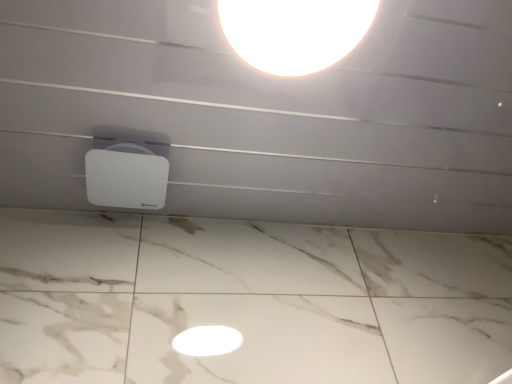
Looking at this image, in order to face white matte speaker at center, arranged as the 2th lamp when viewed from the front, should I rotate leftwards or rightwards?

Turn left by 16.755 degrees to look at white matte speaker at center, arranged as the 2th lamp when viewed from the front.

This screenshot has height=384, width=512. What do you see at coordinates (126, 179) in the screenshot?
I see `white matte speaker at center, the second lamp from the right` at bounding box center [126, 179].

The image size is (512, 384). I want to click on white matte speaker at center, arranged as the 2th lamp when viewed from the front, so tap(126, 179).

From the picture: Measure the distance between white matte speaker at center, arranged as the 2th lamp when viewed from the front, and camera.

The depth of white matte speaker at center, arranged as the 2th lamp when viewed from the front, is 36.67 inches.

Image resolution: width=512 pixels, height=384 pixels. I want to click on white glossy lampshade at upper center, placed as the 2th lamp when sorted from left to right, so click(x=294, y=32).

This screenshot has width=512, height=384. What do you see at coordinates (294, 32) in the screenshot?
I see `white glossy lampshade at upper center, the 2th lamp viewed from the back` at bounding box center [294, 32].

How much space does white glossy lampshade at upper center, positioned as the first lamp in front-to-back order, occupy vertically?

2.55 inches.

Where is `white matte speaker at center, the 1th lamp ordered from the bottom`? Image resolution: width=512 pixels, height=384 pixels. white matte speaker at center, the 1th lamp ordered from the bottom is located at coordinates (126, 179).

Is white matte speaker at center, which is the second lamp in top-to-bottom order, at the right side of white glossy lampshade at upper center, the 2th lamp viewed from the back?

No.

In the scene shown: Which is in front, white matte speaker at center, marked as the 1th lamp in a back-to-front arrangement, or white glossy lampshade at upper center, placed as the 2th lamp when sorted from left to right?

white glossy lampshade at upper center, placed as the 2th lamp when sorted from left to right, is closer to the camera.

Which is farther from the camera, (143,179) or (238,23)?

Positioned behind is point (143,179).

From the image's perspective, who appears lower, white matte speaker at center, the 1th lamp ordered from the bottom, or white glossy lampshade at upper center, the 2th lamp viewed from the back?

white matte speaker at center, the 1th lamp ordered from the bottom, appears lower in the image.

From a real-world perspective, which object stands above the other?

white matte speaker at center, which appears as the 1th lamp when viewed from the left, from a real-world perspective.

Is white matte speaker at center, marked as the 1th lamp in a back-to-front arrangement, thinner than white glossy lampshade at upper center, the second lamp from the bottom?

Yes.

Considering the relative sizes of white matte speaker at center, the 1th lamp ordered from the bottom, and white glossy lampshade at upper center, the second lamp from the bottom, in the image provided, is white matte speaker at center, the 1th lamp ordered from the bottom, taller than white glossy lampshade at upper center, the second lamp from the bottom,?

No.

In terms of size, does white matte speaker at center, marked as the 1th lamp in a back-to-front arrangement, appear bigger or smaller than white glossy lampshade at upper center, the second lamp from the bottom?

Clearly, white matte speaker at center, marked as the 1th lamp in a back-to-front arrangement, is smaller in size than white glossy lampshade at upper center, the second lamp from the bottom.

Is white glossy lampshade at upper center, placed as the 2th lamp when sorted from left to right, completely or partially inside white matte speaker at center, which appears as the 1th lamp when viewed from the left?

Definitely not — white glossy lampshade at upper center, placed as the 2th lamp when sorted from left to right, is not inside white matte speaker at center, which appears as the 1th lamp when viewed from the left.

Is white matte speaker at center, the 1th lamp ordered from the bottom, with white glossy lampshade at upper center, the second lamp from the bottom?

white matte speaker at center, the 1th lamp ordered from the bottom, is not next to white glossy lampshade at upper center, the second lamp from the bottom, and they're not touching.

Is white matte speaker at center, marked as the 1th lamp in a back-to-front arrangement, oriented towards white glossy lampshade at upper center, the 2th lamp viewed from the back?

Yes, white matte speaker at center, marked as the 1th lamp in a back-to-front arrangement, is facing white glossy lampshade at upper center, the 2th lamp viewed from the back.

How many degrees apart are the facing directions of white matte speaker at center, the second lamp from the right, and white glossy lampshade at upper center, positioned as the first lamp in front-to-back order?

The facing directions of white matte speaker at center, the second lamp from the right, and white glossy lampshade at upper center, positioned as the first lamp in front-to-back order, are 5.22 degrees apart.

The image size is (512, 384). Find the location of `lamp on the right of white matte speaker at center, arranged as the 2th lamp when viewed from the front`. lamp on the right of white matte speaker at center, arranged as the 2th lamp when viewed from the front is located at coordinates (294, 32).

In the image, is white glossy lampshade at upper center, the second lamp from the bottom, on the left side or the right side of white matte speaker at center, arranged as the 2th lamp when viewed from the front?

white glossy lampshade at upper center, the second lamp from the bottom, is positioned on white matte speaker at center, arranged as the 2th lamp when viewed from the front,'s right side.

Does white glossy lampshade at upper center, placed as the 2th lamp when sorted from left to right, come behind white matte speaker at center, which is the second lamp in top-to-bottom order?

No, it is not.

Between point (247, 48) and point (149, 165), which one is positioned in front?

Point (247, 48)

From the image's perspective, is white glossy lampshade at upper center, the 2th lamp viewed from the back, located above or below white matte speaker at center, the second lamp from the right?

From the image's perspective, white glossy lampshade at upper center, the 2th lamp viewed from the back, appears above white matte speaker at center, the second lamp from the right.

From a real-world perspective, who is located lower, white glossy lampshade at upper center, the 1th lamp in the top-to-bottom sequence, or white matte speaker at center, marked as the 1th lamp in a back-to-front arrangement?

white glossy lampshade at upper center, the 1th lamp in the top-to-bottom sequence, from a real-world perspective.

Considering the relative sizes of white glossy lampshade at upper center, placed as the 2th lamp when sorted from left to right, and white matte speaker at center, the second lamp from the right, in the image provided, is white glossy lampshade at upper center, placed as the 2th lamp when sorted from left to right, thinner than white matte speaker at center, the second lamp from the right,?

In fact, white glossy lampshade at upper center, placed as the 2th lamp when sorted from left to right, might be wider than white matte speaker at center, the second lamp from the right.

From their relative heights in the image, would you say white glossy lampshade at upper center, positioned as the first lamp in right-to-left order, is taller or shorter than white matte speaker at center, marked as the 1th lamp in a back-to-front arrangement?

In the image, white glossy lampshade at upper center, positioned as the first lamp in right-to-left order, appears to be taller than white matte speaker at center, marked as the 1th lamp in a back-to-front arrangement.

Is white glossy lampshade at upper center, the 1th lamp in the top-to-bottom sequence, smaller than white matte speaker at center, which appears as the 1th lamp when viewed from the left?

No.

Do you think white glossy lampshade at upper center, positioned as the first lamp in right-to-left order, is within white matte speaker at center, which is the second lamp in top-to-bottom order, or outside of it?

white glossy lampshade at upper center, positioned as the first lamp in right-to-left order, is not inside white matte speaker at center, which is the second lamp in top-to-bottom order, it's outside.

Does white glossy lampshade at upper center, the second lamp from the bottom, touch white matte speaker at center, the 1th lamp ordered from the bottom?

white glossy lampshade at upper center, the second lamp from the bottom, and white matte speaker at center, the 1th lamp ordered from the bottom, are not in contact.

Is white glossy lampshade at upper center, positioned as the first lamp in right-to-left order, oriented towards white matte speaker at center, which appears as the 1th lamp when viewed from the left?

No, white glossy lampshade at upper center, positioned as the first lamp in right-to-left order, does not turn towards white matte speaker at center, which appears as the 1th lamp when viewed from the left.

What's the angular difference between white glossy lampshade at upper center, positioned as the first lamp in right-to-left order, and white matte speaker at center, arranged as the 2th lamp when viewed from the front,'s facing directions?

They differ by 5.22 degrees in their facing directions.

Where is `lamp located below the white glossy lampshade at upper center, placed as the 2th lamp when sorted from left to right (from the image's perspective)`? lamp located below the white glossy lampshade at upper center, placed as the 2th lamp when sorted from left to right (from the image's perspective) is located at coordinates (126, 179).

Find the location of a particular element. The width and height of the screenshot is (512, 384). lamp positioned vertically above the white glossy lampshade at upper center, positioned as the first lamp in right-to-left order (from a real-world perspective) is located at coordinates (126, 179).

The image size is (512, 384). I want to click on lamp on the left side of white glossy lampshade at upper center, positioned as the first lamp in front-to-back order, so click(x=126, y=179).